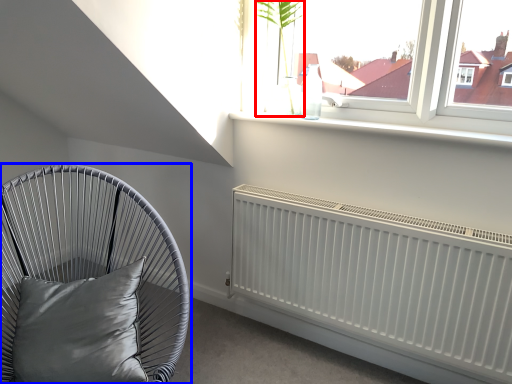
Question: Which object is further to the camera taking this photo, plant (highlighted by a red box) or furniture (highlighted by a blue box)?

Choices:
 (A) plant
 (B) furniture

Answer: (A)